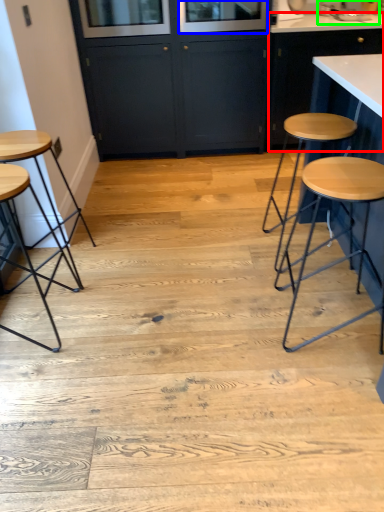
Question: Considering the real-world distances, which object is farthest from cabinetry (highlighted by a red box)? window screen (highlighted by a blue box) or sink (highlighted by a green box)?

Choices:
 (A) window screen
 (B) sink

Answer: (B)